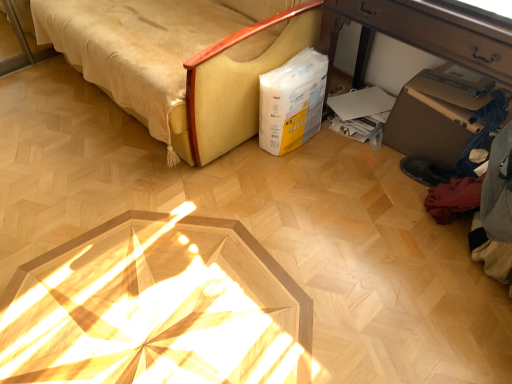
The height and width of the screenshot is (384, 512). Describe the element at coordinates (292, 102) in the screenshot. I see `white paper bag at center-right` at that location.

Find the location of a particular element. white paper bag at center-right is located at coordinates (292, 102).

Is beige fabric sofa at upper left at the back of brown cardboard box at lower right?

No, brown cardboard box at lower right is not facing away from beige fabric sofa at upper left.

Is brown cardboard box at lower right not near beige fabric sofa at upper left?

No.

From a real-world perspective, is brown cardboard box at lower right physically below beige fabric sofa at upper left?

Yes.

Is white paper bag at center-right next to wooden desk at lower right?

No, white paper bag at center-right is not touching wooden desk at lower right.

Is point (269, 82) closer to viewer compared to point (482, 49)?

No, it is behind (482, 49).

Is white paper bag at center-right looking in the opposite direction of wooden desk at lower right?

Yes.

Is white paper bag at center-right bigger than wooden desk at lower right?

No, white paper bag at center-right is not bigger than wooden desk at lower right.

From the image's perspective, would you say wooden desk at lower right is positioned over beige fabric sofa at upper left?

Incorrect, from the image's perspective, wooden desk at lower right is lower than beige fabric sofa at upper left.

Between wooden desk at lower right and beige fabric sofa at upper left, which one appears on the right side from the viewer's perspective?

wooden desk at lower right is more to the right.

Can you confirm if wooden desk at lower right is thinner than beige fabric sofa at upper left?

Yes.

From the image's perspective, is beige fabric sofa at upper left above or below wooden desk at lower right?

beige fabric sofa at upper left is above wooden desk at lower right.

Between beige fabric sofa at upper left and wooden desk at lower right, which one is positioned in front?

wooden desk at lower right.

Is beige fabric sofa at upper left wider than wooden desk at lower right?

Yes.

Consider the image. Is brown cardboard box at lower right touching wooden desk at lower right?

No, brown cardboard box at lower right is not beside wooden desk at lower right.

Is wooden desk at lower right surrounded by brown cardboard box at lower right?

No, wooden desk at lower right is not a part of brown cardboard box at lower right.

Can you tell me how much brown cardboard box at lower right and wooden desk at lower right differ in facing direction?

brown cardboard box at lower right and wooden desk at lower right are facing 2.95 degrees away from each other.

Would you say brown cardboard box at lower right is part of white paper bag at center-right's contents?

No, brown cardboard box at lower right is not inside white paper bag at center-right.

In the scene shown: Does white paper bag at center-right have a larger size compared to brown cardboard box at lower right?

No.

Is white paper bag at center-right in front of brown cardboard box at lower right?

No, white paper bag at center-right is further to the viewer.

Does white paper bag at center-right turn towards brown cardboard box at lower right?

No, white paper bag at center-right is not oriented towards brown cardboard box at lower right.

Considering the sizes of objects wooden desk at lower right and white paper bag at center-right in the image provided, who is smaller, wooden desk at lower right or white paper bag at center-right?

white paper bag at center-right is smaller.

I want to click on box that is below the wooden desk at lower right (from the image's perspective), so click(292, 102).

Between point (464, 66) and point (277, 92), which one is positioned in front?

The point (464, 66) is closer.

Based on the photo, is wooden desk at lower right at the right side of white paper bag at center-right?

Yes, wooden desk at lower right is to the right of white paper bag at center-right.

Where is `cardboard box located underneath the beige fabric sofa at upper left (from a real-world perspective)`? The image size is (512, 384). cardboard box located underneath the beige fabric sofa at upper left (from a real-world perspective) is located at coordinates (437, 113).

What are the coordinates of `box that is behind the wooden desk at lower right` in the screenshot? It's located at (292, 102).

Based on their spatial positions, is beige fabric sofa at upper left or white paper bag at center-right further from wooden desk at lower right?

beige fabric sofa at upper left is positioned further to the anchor wooden desk at lower right.

Estimate the real-world distances between objects in this image. Which object is closer to white paper bag at center-right, brown cardboard box at lower right or wooden desk at lower right?

wooden desk at lower right is positioned closer to the anchor white paper bag at center-right.

In the scene shown: Based on their spatial positions, is wooden desk at lower right or white paper bag at center-right closer to brown cardboard box at lower right?

wooden desk at lower right lies closer to brown cardboard box at lower right than the other object.

Looking at the image, which one is located closer to wooden desk at lower right, white paper bag at center-right or brown cardboard box at lower right?

Among the two, white paper bag at center-right is located nearer to wooden desk at lower right.

Looking at the image, which one is located further to beige fabric sofa at upper left, wooden desk at lower right or brown cardboard box at lower right?

The object further to beige fabric sofa at upper left is brown cardboard box at lower right.

Based on their spatial positions, is wooden desk at lower right or beige fabric sofa at upper left further from brown cardboard box at lower right?

beige fabric sofa at upper left is further to brown cardboard box at lower right.

When comparing their distances from beige fabric sofa at upper left, does brown cardboard box at lower right or white paper bag at center-right seem further?

brown cardboard box at lower right.

Which object lies further to the anchor point wooden desk at lower right, brown cardboard box at lower right or white paper bag at center-right?

brown cardboard box at lower right.

Identify the location of box situated between beige fabric sofa at upper left and wooden desk at lower right from left to right. [x=292, y=102].

Where is `table between beige fabric sofa at upper left and brown cardboard box at lower right`? This screenshot has width=512, height=384. table between beige fabric sofa at upper left and brown cardboard box at lower right is located at coordinates (417, 35).

The image size is (512, 384). I want to click on table between white paper bag at center-right and brown cardboard box at lower right from left to right, so [x=417, y=35].

Image resolution: width=512 pixels, height=384 pixels. I want to click on box located between beige fabric sofa at upper left and brown cardboard box at lower right in the left-right direction, so click(292, 102).